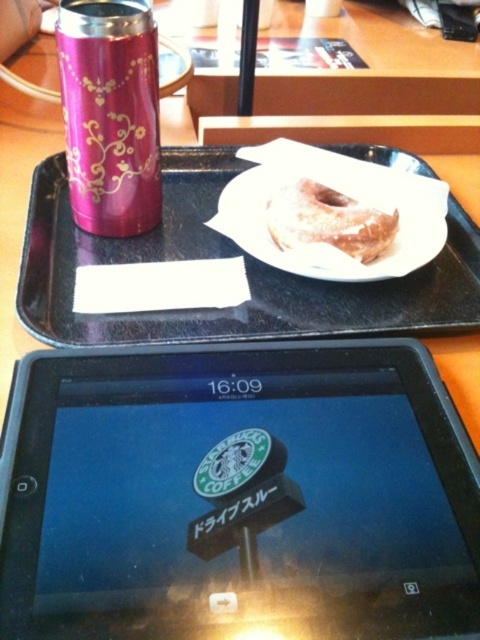
You are a delivery person who needs to place a package on the black plastic tray at upper center. The package is 19 inches long. Can you fit it on the tray without exceeding the space between the tray and the camera?

The black plastic tray at upper center and camera are 18.96 inches apart. Since the package is 19 inches long, it is slightly longer than the available space between the tray and the camera. Therefore, the package cannot be placed there without exceeding the space.

You are a customer at the cafe and want to place your order using the black plastic tablet at bottom. However, there is a glazed sugar donut at center on the tray. Where should you move the donut to access the tablet?

The black plastic tablet at bottom is to the left of the glazed sugar donut at center, so you should move the glazed sugar donut at center to the right to access the tablet.